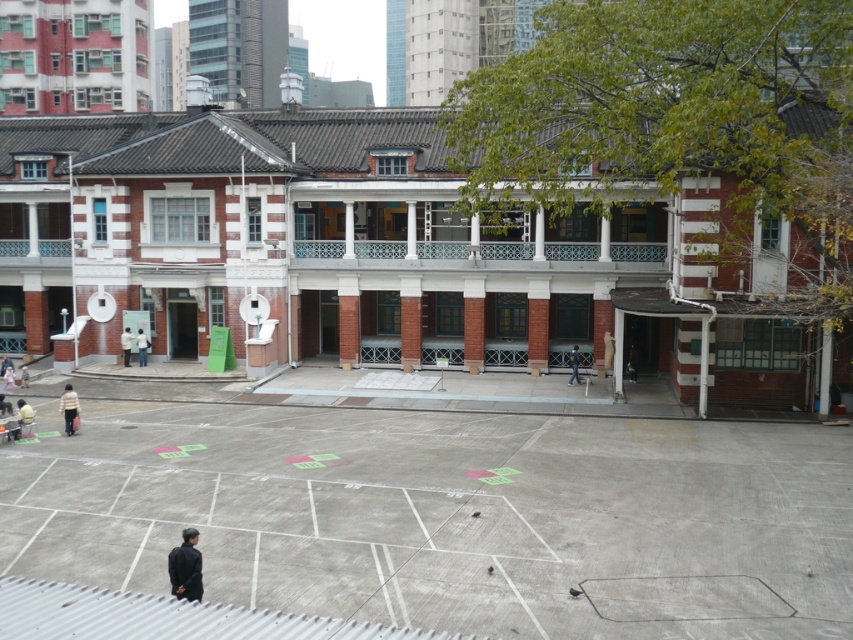
Which is more to the left, dark gray fabric jacket at lower left or light beige fabric jacket at lower left?

From the viewer's perspective, light beige fabric jacket at lower left appears more on the left side.

Is dark gray fabric jacket at lower left wider than light beige fabric jacket at lower left?

Yes.

Which is behind, point (186, 534) or point (123, 352)?

The point (123, 352) is behind.

Locate an element on the screen. The image size is (853, 640). dark gray fabric jacket at lower left is located at coordinates (184, 566).

Consider the image. Is striped sweater at lower left closer to camera compared to light beige fabric jacket at lower left?

Yes, striped sweater at lower left is in front of light beige fabric jacket at lower left.

Does point (64, 412) come closer to viewer compared to point (126, 339)?

That is True.

Which is behind, point (77, 404) or point (120, 342)?

The point (120, 342) is more distant.

Where is `striped sweater at lower left`? striped sweater at lower left is located at coordinates (68, 406).

Locate an element on the screen. This screenshot has width=853, height=640. light brown wooden door at center left is located at coordinates (142, 346).

From the picture: Which is more to the right, light brown wooden door at center left or light beige fabric jacket at lower left?

light brown wooden door at center left is more to the right.

Between point (141, 330) and point (125, 337), which one is positioned behind?

Positioned behind is point (141, 330).

You are a GUI agent. You are given a task and a screenshot of the screen. Output one action in this format:
    pyautogui.click(x=<x>, y=<y>)
    Task: Click on the light brown wooden door at center left
    
    Given the screenshot: What is the action you would take?
    pyautogui.click(x=142, y=346)